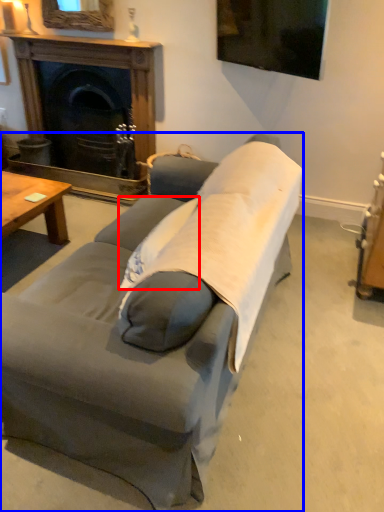
Question: Which point is further to the camera, pillow (highlighted by a red box) or studio couch (highlighted by a blue box)?

Choices:
 (A) pillow
 (B) studio couch

Answer: (A)